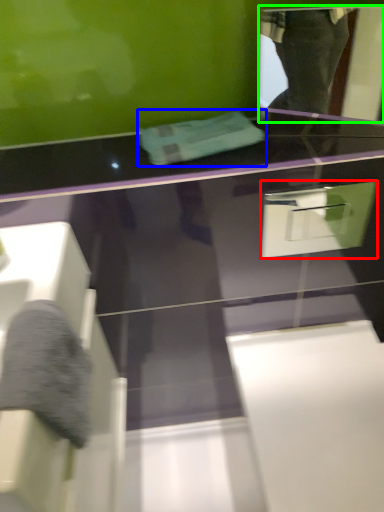
Question: Which object is the farthest from drawer (highlighted by a red box)? Choose among these: towel (highlighted by a blue box) or mirror (highlighted by a green box).

Choices:
 (A) towel
 (B) mirror

Answer: (B)